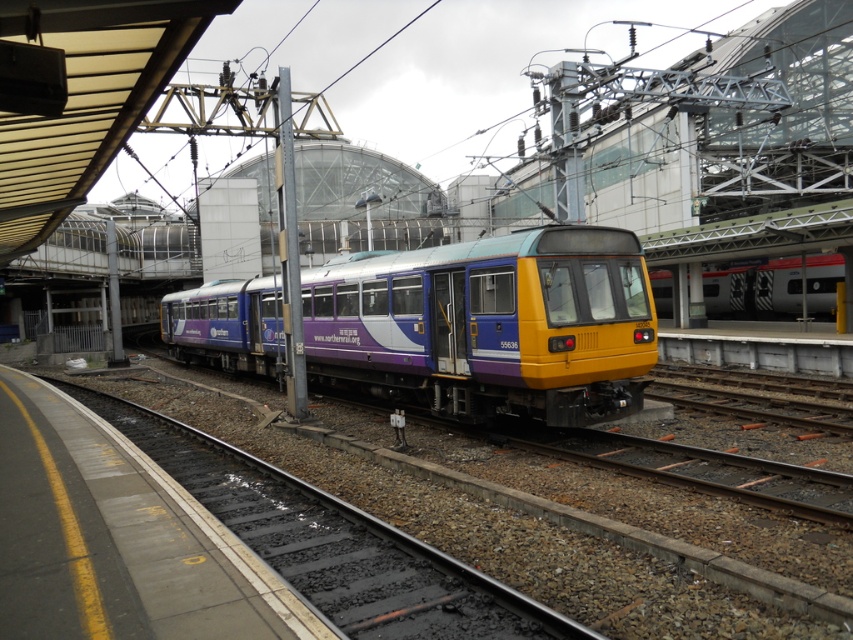
You are a passenger waiting on the platform at the train station. You notice the matte purple train at center and the smooth concrete track at center. Which object takes up more space in the image?

The matte purple train at center is larger in size than the smooth concrete track at center, so it takes up more space in the image.

You are a station engineer who needs to ensure the trains fit within the platform width. Given that the platform is exactly 3 meters wide, and you observe the matte purple train at center and the red and white striped train at center, which train would require more space to accommodate its width?

The matte purple train at center is wider than the red and white striped train at center, so it would require more space to accommodate its width.